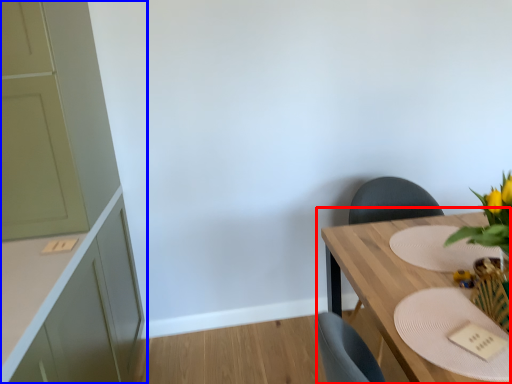
Question: Which object appears farthest to the camera in this image, table (highlighted by a red box) or cabinetry (highlighted by a blue box)?

Choices:
 (A) table
 (B) cabinetry

Answer: (B)